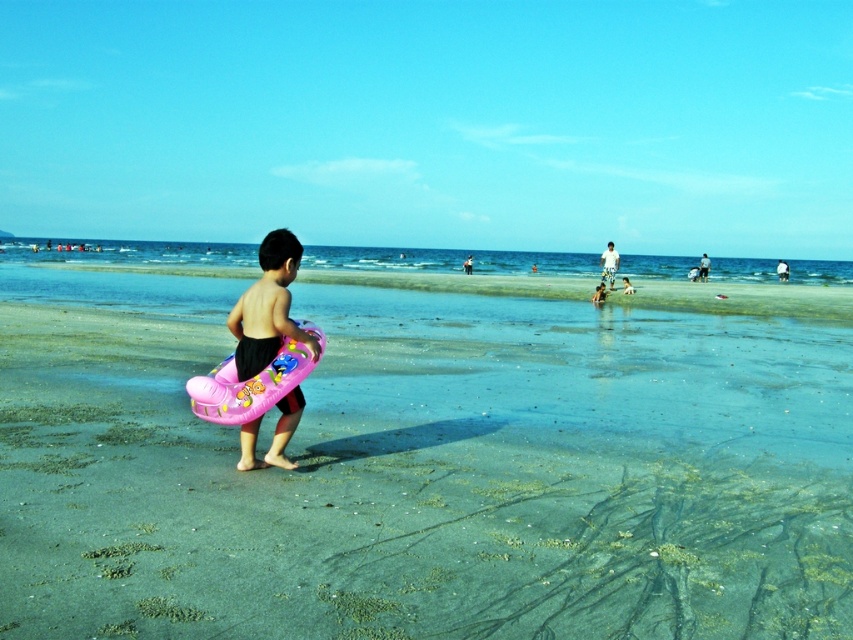
You are a photographer standing at the edge of the beach. You want to capture the pink rubber ring at center in your shot. Which direction should you face to ensure the ring is centered in your camera view?

The pink rubber ring at center is located at point coordinates of (431,476), so you should face towards the center of the beach to capture it in the center of your camera view.

You are standing on the beach and want to reach the clear blue water at center. Based on the scene description, in which direction should you walk from your current position?

The clear blue water at center is located at point (450, 260) in the image. Since the child is in the foreground and the water is at the center, you should walk towards the direction where the water is located, which is likely forward or straight ahead from the child.